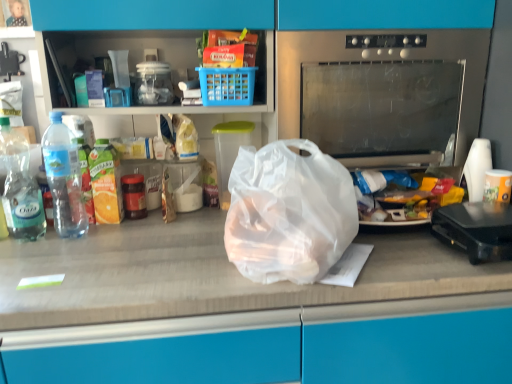
Find the location of a particular element. The height and width of the screenshot is (384, 512). free spot in front of clear plastic bottle at left, the 2th bottle when ordered from right to left is located at coordinates (25, 257).